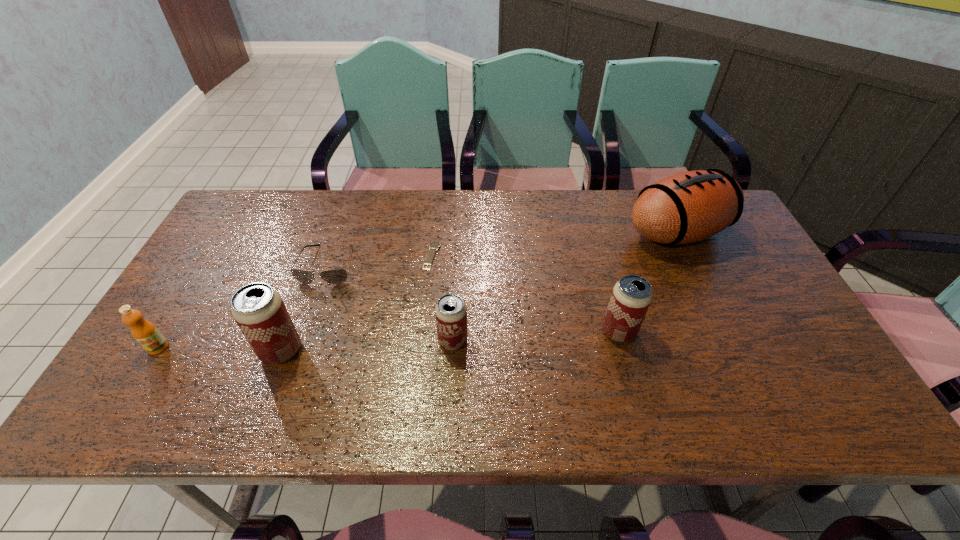
Locate which beer can ranks second in proximity to the orange juice. Please provide its 2D coordinates. Your answer should be formatted as a tuple, i.e. [(x, y)], where the tuple contains the x and y coordinates of a point satisfying the conditions above.

[(451, 313)]

You are a GUI agent. You are given a task and a screenshot of the screen. Output one action in this format:
    pyautogui.click(x=<x>, y=<y>)
    Task: Click on the free space that satisfies the following two spatial constraints: 1. on the front label of the leftmost beer can; 2. on the right side of the leftmost object
    This screenshot has height=540, width=960.
    Given the screenshot: What is the action you would take?
    pyautogui.click(x=156, y=350)

Locate an element on the screen. The height and width of the screenshot is (540, 960). free spot that satisfies the following two spatial constraints: 1. on the front label of the leftmost beer can; 2. on the left side of the leftmost object is located at coordinates (156, 350).

The image size is (960, 540). I want to click on free space that satisfies the following two spatial constraints: 1. on the back side of the rightmost object; 2. on the left side of the watch, so (x=435, y=233).